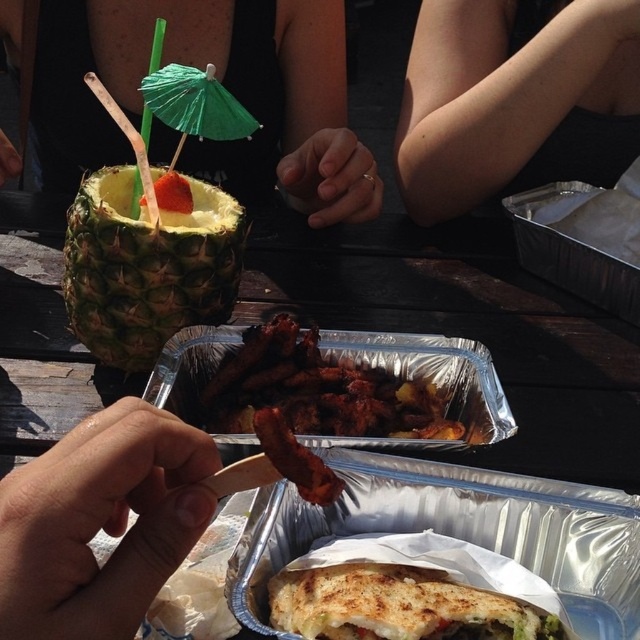
Question: Which of the following is the farthest from the observer?

Choices:
 (A) brown skin at center
 (B) golden crispy sandwich at center
 (C) green paper umbrella at upper left
 (D) slightly charred wood at center

Answer: (D)

Question: Does brown skin at center have a lesser width compared to green paper umbrella at upper left?

Choices:
 (A) yes
 (B) no

Answer: (B)

Question: Based on their relative distances, which object is farther from the brown skin at center?

Choices:
 (A) golden crispy sandwich at center
 (B) smoked crispy bacon at center

Answer: (A)

Question: Is green pineapple at upper left closer to the viewer compared to golden crispy sandwich at center?

Choices:
 (A) yes
 (B) no

Answer: (B)

Question: Estimate the real-world distances between objects in this image. Which object is farther from the skinny arm at upper center?

Choices:
 (A) smoked crispy bacon at center
 (B) slightly charred wood at center
 (C) green paper umbrella at upper left
 (D) green pineapple at upper left

Answer: (A)

Question: Can you confirm if skinny arm at upper center is positioned to the right of brown skin at center?

Choices:
 (A) yes
 (B) no

Answer: (A)